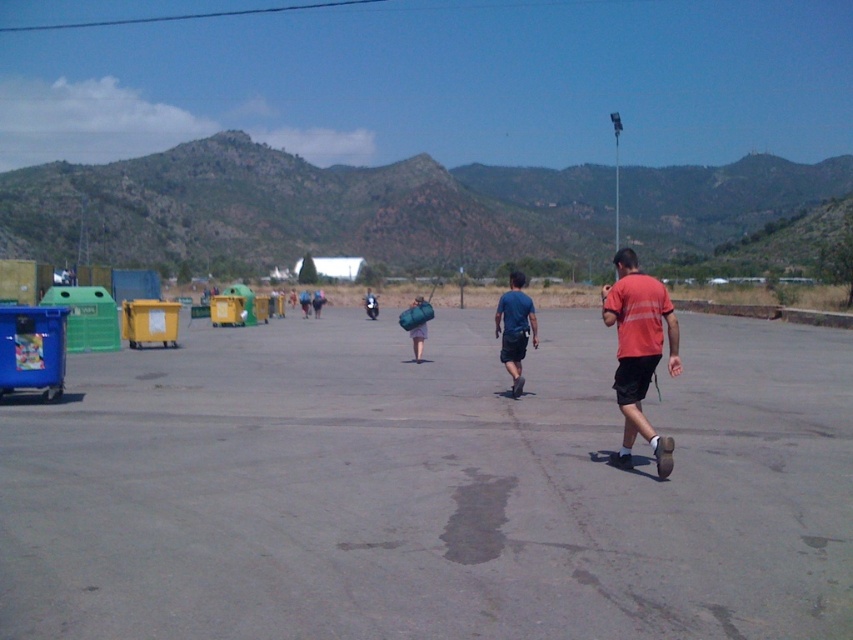
Question: Which of the following is the closest to the observer?

Choices:
 (A) (375, 317)
 (B) (641, 308)
 (C) (521, 321)
 (D) (183, 548)

Answer: (D)

Question: Which point appears closest to the camera in this image?

Choices:
 (A) (248, 636)
 (B) (512, 284)

Answer: (A)

Question: Is blue fabric shirt at center to the right of matte blue backpack at center from the viewer's perspective?

Choices:
 (A) no
 (B) yes

Answer: (B)

Question: Can you confirm if gray asphalt parking lot at center is bigger than matte blue backpack at center?

Choices:
 (A) yes
 (B) no

Answer: (A)

Question: Which of these objects is positioned farthest from the gray asphalt parking lot at center?

Choices:
 (A) blue fabric shirt at center
 (B) orange cotton t-shirt at right
 (C) matte blue backpack at center

Answer: (C)

Question: Can you confirm if gray asphalt parking lot at center is positioned to the right of orange cotton t-shirt at right?

Choices:
 (A) no
 (B) yes

Answer: (A)